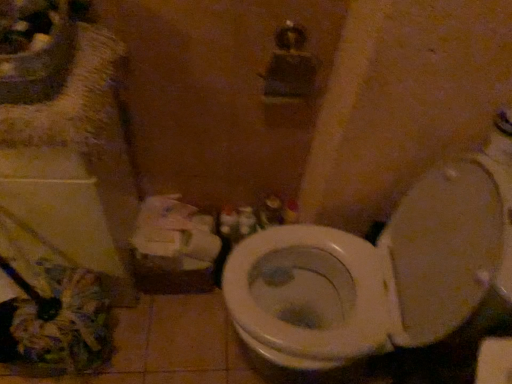
Question: From a real-world perspective, is matte white sink at upper left positioned above or below white matte toilet paper at lower left?

Choices:
 (A) above
 (B) below

Answer: (A)

Question: Considering the positions of matte white sink at upper left and white matte toilet paper at lower left in the image, is matte white sink at upper left wider or thinner than white matte toilet paper at lower left?

Choices:
 (A) wide
 (B) thin

Answer: (A)

Question: Which object is the farthest from the white glossy toilet at center?

Choices:
 (A) white plastic container at center
 (B) white matte toilet paper at lower left
 (C) matte white sink at upper left

Answer: (C)

Question: Considering the real-world distances, which object is closest to the matte white sink at upper left?

Choices:
 (A) white glossy toilet at center
 (B) white plastic container at center
 (C) white matte toilet paper at lower left

Answer: (C)